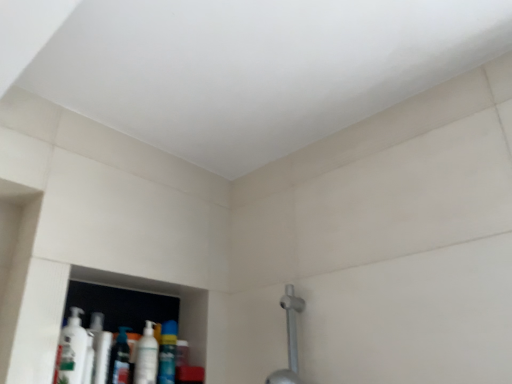
This screenshot has width=512, height=384. Identify the location of silver metallic shower at lower right. (292, 324).

How much space does white glossy mouthwash at lower left, acting as the third mouthwash starting from the left, occupy vertically?

8.55 inches.

Locate an element on the screen. blue glossy mouthwash at lower left, which appears as the 4th mouthwash when viewed from the left is located at coordinates 167,353.

What do you see at coordinates (167, 353) in the screenshot?
I see `blue glossy mouthwash at lower left, the 1th mouthwash when ordered from right to left` at bounding box center [167, 353].

What is the approximate width of white glossy mouthwash at lower left, arranged as the 1th mouthwash when viewed from the left?

white glossy mouthwash at lower left, arranged as the 1th mouthwash when viewed from the left, is 3.56 inches wide.

Based on the photo, measure the distance between point (78,316) and camera.

Point (78,316) is 1.26 meters away from camera.

This screenshot has width=512, height=384. What are the coordinates of `silver metallic shower at lower right` in the screenshot? It's located at (292, 324).

Which is more to the left, blue glossy mouthwash at lower left, the 1th mouthwash when ordered from right to left, or translucent plastic mouthwash at lower left, the third mouthwash viewed from the right?

translucent plastic mouthwash at lower left, the third mouthwash viewed from the right.

Is blue glossy mouthwash at lower left, which appears as the 4th mouthwash when viewed from the left, facing towards translucent plastic mouthwash at lower left, which is the second mouthwash in left-to-right order?

No, blue glossy mouthwash at lower left, which appears as the 4th mouthwash when viewed from the left, is not turned towards translucent plastic mouthwash at lower left, which is the second mouthwash in left-to-right order.

Does point (175, 361) lie behind point (124, 375)?

That is True.

Is silver metallic shower at lower right spatially inside white glossy mouthwash at lower left, acting as the 4th mouthwash starting from the right, or outside of it?

The correct answer is: outside.

Does point (291, 303) lie behind point (56, 367)?

Yes, it is behind point (56, 367).

In order to click on mouthwash in front of the silver metallic shower at lower right in this screenshot , I will do `click(71, 350)`.

From a real-world perspective, who is located lower, translucent plastic mouthwash at lower left, which is the second mouthwash in left-to-right order, or blue glossy mouthwash at lower left, the 1th mouthwash when ordered from right to left?

From a 3D spatial view, translucent plastic mouthwash at lower left, which is the second mouthwash in left-to-right order, is below.

Is translucent plastic mouthwash at lower left, the third mouthwash viewed from the right, facing towards blue glossy mouthwash at lower left, the 1th mouthwash when ordered from right to left?

No.

Is translucent plastic mouthwash at lower left, the third mouthwash viewed from the right, inside or outside of blue glossy mouthwash at lower left, which appears as the 4th mouthwash when viewed from the left?

translucent plastic mouthwash at lower left, the third mouthwash viewed from the right, is outside blue glossy mouthwash at lower left, which appears as the 4th mouthwash when viewed from the left.

Looking at this image, which object is wider, translucent plastic mouthwash at lower left, the third mouthwash viewed from the right, or blue glossy mouthwash at lower left, which appears as the 4th mouthwash when viewed from the left?

blue glossy mouthwash at lower left, which appears as the 4th mouthwash when viewed from the left.

Is translucent plastic mouthwash at lower left, the third mouthwash viewed from the right, in front of or behind white glossy mouthwash at lower left, acting as the third mouthwash starting from the left, in the image?

In the image, translucent plastic mouthwash at lower left, the third mouthwash viewed from the right, appears behind white glossy mouthwash at lower left, acting as the third mouthwash starting from the left.

Between translucent plastic mouthwash at lower left, the third mouthwash viewed from the right, and white glossy mouthwash at lower left, acting as the third mouthwash starting from the left, which one has larger size?

Bigger between the two is white glossy mouthwash at lower left, acting as the third mouthwash starting from the left.

This screenshot has height=384, width=512. Find the location of `mouthwash that is the 1st one when counting forward from the translucent plastic mouthwash at lower left, the third mouthwash viewed from the right`. mouthwash that is the 1st one when counting forward from the translucent plastic mouthwash at lower left, the third mouthwash viewed from the right is located at coordinates (146, 357).

Is translucent plastic mouthwash at lower left, the third mouthwash viewed from the right, positioned with its back to white glossy mouthwash at lower left, acting as the third mouthwash starting from the left?

No, translucent plastic mouthwash at lower left, the third mouthwash viewed from the right,'s orientation is not away from white glossy mouthwash at lower left, acting as the third mouthwash starting from the left.

From the picture: Is white glossy mouthwash at lower left, which is the 2th mouthwash in right-to-left order, turned away from translucent plastic mouthwash at lower left, which is the second mouthwash in left-to-right order?

white glossy mouthwash at lower left, which is the 2th mouthwash in right-to-left order, is not turned away from translucent plastic mouthwash at lower left, which is the second mouthwash in left-to-right order.

Does white glossy mouthwash at lower left, acting as the third mouthwash starting from the left, come in front of translucent plastic mouthwash at lower left, the third mouthwash viewed from the right?

Yes, it is.

Which object is positioned more to the right, white glossy mouthwash at lower left, acting as the third mouthwash starting from the left, or translucent plastic mouthwash at lower left, the third mouthwash viewed from the right?

Positioned to the right is white glossy mouthwash at lower left, acting as the third mouthwash starting from the left.

Is white glossy mouthwash at lower left, which is the 2th mouthwash in right-to-left order, bigger or smaller than translucent plastic mouthwash at lower left, which is the second mouthwash in left-to-right order?

In the image, white glossy mouthwash at lower left, which is the 2th mouthwash in right-to-left order, appears to be larger than translucent plastic mouthwash at lower left, which is the second mouthwash in left-to-right order.

Considering the sizes of objects white glossy mouthwash at lower left, acting as the third mouthwash starting from the left, and silver metallic shower at lower right in the image provided, who is wider, white glossy mouthwash at lower left, acting as the third mouthwash starting from the left, or silver metallic shower at lower right?

Wider between the two is silver metallic shower at lower right.

Between white glossy mouthwash at lower left, acting as the third mouthwash starting from the left, and silver metallic shower at lower right, which one has less height?

white glossy mouthwash at lower left, acting as the third mouthwash starting from the left.

From the image's perspective, who appears lower, white glossy mouthwash at lower left, acting as the third mouthwash starting from the left, or silver metallic shower at lower right?

white glossy mouthwash at lower left, acting as the third mouthwash starting from the left, appears lower in the image.

Between white glossy mouthwash at lower left, which is the 2th mouthwash in right-to-left order, and silver metallic shower at lower right, which one appears on the right side from the viewer's perspective?

silver metallic shower at lower right.

Can you tell me how much silver metallic shower at lower right and blue glossy mouthwash at lower left, which appears as the 4th mouthwash when viewed from the left, differ in facing direction?

There is a 89.1-degree angle between the facing directions of silver metallic shower at lower right and blue glossy mouthwash at lower left, which appears as the 4th mouthwash when viewed from the left.

Is silver metallic shower at lower right at the left side of blue glossy mouthwash at lower left, the 1th mouthwash when ordered from right to left?

No.

Is the surface of silver metallic shower at lower right in direct contact with blue glossy mouthwash at lower left, the 1th mouthwash when ordered from right to left?

No, silver metallic shower at lower right is not making contact with blue glossy mouthwash at lower left, the 1th mouthwash when ordered from right to left.

Locate an element on the screen. The width and height of the screenshot is (512, 384). mouthwash below the blue glossy mouthwash at lower left, which appears as the 4th mouthwash when viewed from the left (from the image's perspective) is located at coordinates (119, 359).

Find the location of a particular element. The width and height of the screenshot is (512, 384). mouthwash in front of the silver metallic shower at lower right is located at coordinates (71, 350).

From the image, which object appears to be nearer to white glossy mouthwash at lower left, which is the 2th mouthwash in right-to-left order, blue glossy mouthwash at lower left, the 1th mouthwash when ordered from right to left, or translucent plastic mouthwash at lower left, which is the second mouthwash in left-to-right order?

Answer: The object closer to white glossy mouthwash at lower left, which is the 2th mouthwash in right-to-left order, is translucent plastic mouthwash at lower left, which is the second mouthwash in left-to-right order.

In the scene shown: Estimate the real-world distances between objects in this image. Which object is further from blue glossy mouthwash at lower left, which appears as the 4th mouthwash when viewed from the left, white glossy mouthwash at lower left, acting as the third mouthwash starting from the left, or silver metallic shower at lower right?

silver metallic shower at lower right lies further to blue glossy mouthwash at lower left, which appears as the 4th mouthwash when viewed from the left, than the other object.

Estimate the real-world distances between objects in this image. Which object is further from translucent plastic mouthwash at lower left, the third mouthwash viewed from the right, silver metallic shower at lower right or white glossy mouthwash at lower left, acting as the third mouthwash starting from the left?

silver metallic shower at lower right is positioned further to the anchor translucent plastic mouthwash at lower left, the third mouthwash viewed from the right.

Considering their positions, is translucent plastic mouthwash at lower left, which is the second mouthwash in left-to-right order, positioned further to white glossy mouthwash at lower left, arranged as the 1th mouthwash when viewed from the left, than blue glossy mouthwash at lower left, which appears as the 4th mouthwash when viewed from the left?

blue glossy mouthwash at lower left, which appears as the 4th mouthwash when viewed from the left.

Considering their positions, is blue glossy mouthwash at lower left, which appears as the 4th mouthwash when viewed from the left, positioned closer to translucent plastic mouthwash at lower left, the third mouthwash viewed from the right, than white glossy mouthwash at lower left, acting as the 4th mouthwash starting from the right?

white glossy mouthwash at lower left, acting as the 4th mouthwash starting from the right, lies closer to translucent plastic mouthwash at lower left, the third mouthwash viewed from the right, than the other object.

Which object lies nearer to the anchor point blue glossy mouthwash at lower left, the 1th mouthwash when ordered from right to left, white glossy mouthwash at lower left, arranged as the 1th mouthwash when viewed from the left, or white glossy mouthwash at lower left, acting as the third mouthwash starting from the left?

The object closer to blue glossy mouthwash at lower left, the 1th mouthwash when ordered from right to left, is white glossy mouthwash at lower left, acting as the third mouthwash starting from the left.

When comparing their distances from white glossy mouthwash at lower left, which is the 2th mouthwash in right-to-left order, does translucent plastic mouthwash at lower left, the third mouthwash viewed from the right, or silver metallic shower at lower right seem closer?

translucent plastic mouthwash at lower left, the third mouthwash viewed from the right, lies closer to white glossy mouthwash at lower left, which is the 2th mouthwash in right-to-left order, than the other object.

When comparing their distances from white glossy mouthwash at lower left, acting as the 4th mouthwash starting from the right, does silver metallic shower at lower right or translucent plastic mouthwash at lower left, the third mouthwash viewed from the right, seem further?

Among the two, silver metallic shower at lower right is located further to white glossy mouthwash at lower left, acting as the 4th mouthwash starting from the right.

Find the location of `mouthwash located between white glossy mouthwash at lower left, acting as the 4th mouthwash starting from the right, and translucent plastic mouthwash at lower left, which is the second mouthwash in left-to-right order, in the depth direction`. mouthwash located between white glossy mouthwash at lower left, acting as the 4th mouthwash starting from the right, and translucent plastic mouthwash at lower left, which is the second mouthwash in left-to-right order, in the depth direction is located at coordinates (146, 357).

This screenshot has height=384, width=512. I want to click on mouthwash located between white glossy mouthwash at lower left, which is the 2th mouthwash in right-to-left order, and silver metallic shower at lower right in the left-right direction, so (x=167, y=353).

I want to click on mouthwash between translucent plastic mouthwash at lower left, the third mouthwash viewed from the right, and blue glossy mouthwash at lower left, the 1th mouthwash when ordered from right to left, in the horizontal direction, so click(x=146, y=357).